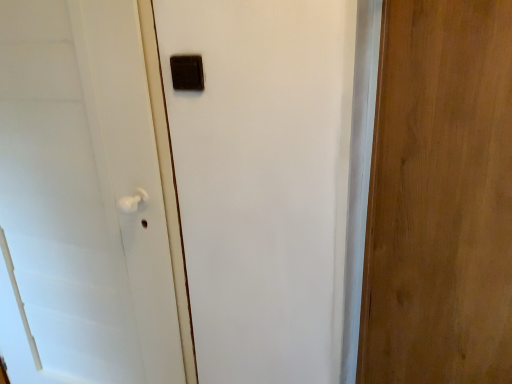
Question: From the image's perspective, would you say white matte door handle at left, the second door in the right-to-left sequence, is positioned over matte brown switch at upper center?

Choices:
 (A) yes
 (B) no

Answer: (B)

Question: Is the depth of white matte door handle at left, the second door in the right-to-left sequence, greater than that of matte brown switch at upper center?

Choices:
 (A) no
 (B) yes

Answer: (A)

Question: Considering the relative sizes of white matte door handle at left, the second door in the right-to-left sequence, and matte brown switch at upper center in the image provided, is white matte door handle at left, the second door in the right-to-left sequence, thinner than matte brown switch at upper center?

Choices:
 (A) no
 (B) yes

Answer: (A)

Question: From the image's perspective, is white matte door handle at left, the first door viewed from the left, located beneath matte brown switch at upper center?

Choices:
 (A) no
 (B) yes

Answer: (B)

Question: Is matte brown switch at upper center surrounded by white matte door handle at left, the second door in the right-to-left sequence?

Choices:
 (A) no
 (B) yes

Answer: (A)

Question: Considering the relative sizes of white matte door handle at left, the first door viewed from the left, and matte brown switch at upper center in the image provided, is white matte door handle at left, the first door viewed from the left, taller than matte brown switch at upper center?

Choices:
 (A) no
 (B) yes

Answer: (B)

Question: Would you say white matte door handle at left, the first door viewed from the left, is part of wooden door at right, which is the first door in right-to-left order,'s contents?

Choices:
 (A) yes
 (B) no

Answer: (B)

Question: Considering the relative sizes of wooden door at right, the 2th door when ordered from left to right, and white matte door handle at left, the first door viewed from the left, in the image provided, is wooden door at right, the 2th door when ordered from left to right, taller than white matte door handle at left, the first door viewed from the left,?

Choices:
 (A) no
 (B) yes

Answer: (A)

Question: From a real-world perspective, is wooden door at right, which is the first door in right-to-left order, located higher than white matte door handle at left, the second door in the right-to-left sequence?

Choices:
 (A) yes
 (B) no

Answer: (A)

Question: Considering the relative sizes of wooden door at right, the 2th door when ordered from left to right, and white matte door handle at left, the first door viewed from the left, in the image provided, is wooden door at right, the 2th door when ordered from left to right, bigger than white matte door handle at left, the first door viewed from the left,?

Choices:
 (A) yes
 (B) no

Answer: (B)

Question: Is wooden door at right, the 2th door when ordered from left to right, located outside white matte door handle at left, the first door viewed from the left?

Choices:
 (A) yes
 (B) no

Answer: (A)

Question: Considering the relative positions of wooden door at right, which is the first door in right-to-left order, and white matte door handle at left, the second door in the right-to-left sequence, in the image provided, is wooden door at right, which is the first door in right-to-left order, to the right of white matte door handle at left, the second door in the right-to-left sequence, from the viewer's perspective?

Choices:
 (A) yes
 (B) no

Answer: (A)

Question: Is white matte door handle at left, the first door viewed from the left, positioned with its back to wooden door at right, the 2th door when ordered from left to right?

Choices:
 (A) no
 (B) yes

Answer: (A)